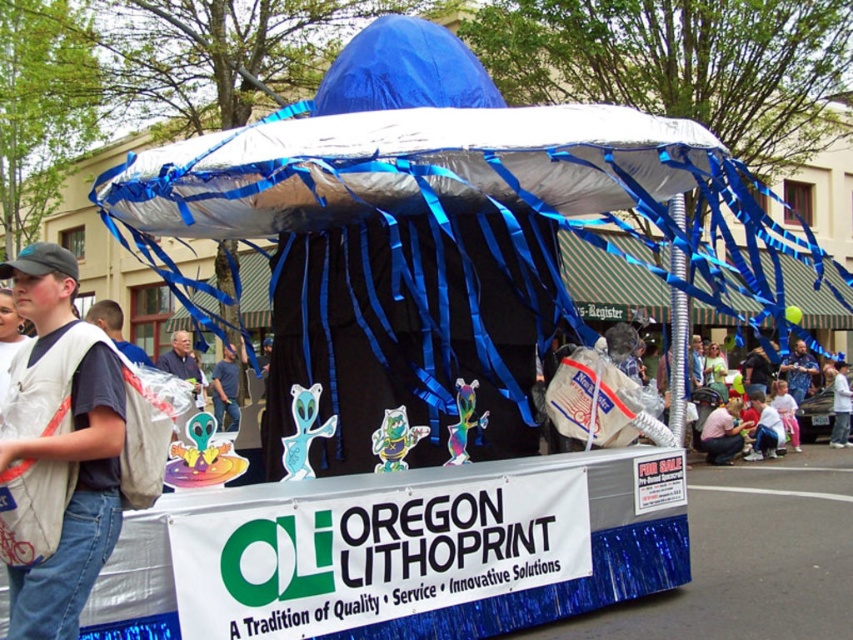
Does white fabric vest at center have a greater width compared to blue fabric shirt at center?

No.

Does white fabric vest at center have a lesser height compared to blue fabric shirt at center?

Incorrect, white fabric vest at center's height does not fall short of blue fabric shirt at center's.

Who is more distant from viewer, [74,584] or [196,401]?

The point [196,401] is behind.

This screenshot has height=640, width=853. Identify the location of white fabric vest at center. (74, 500).